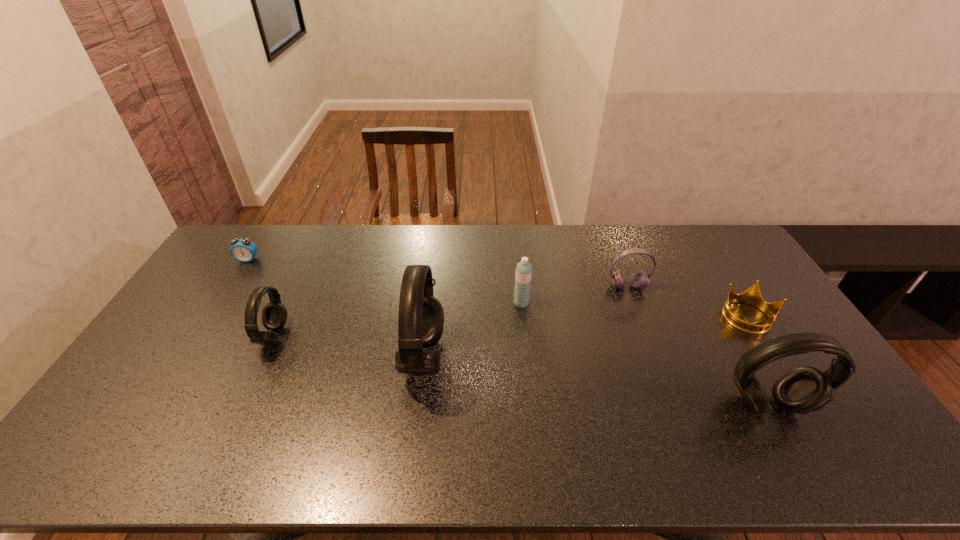
The width and height of the screenshot is (960, 540). What are the coordinates of `vacant space at the near right corner of the desktop` in the screenshot? It's located at (832, 406).

At what (x,y) coordinates should I click in order to perform the action: click on vacant space that is in between the sixth object from right to left and the crown. Please return your answer as a coordinate pair (x, y). Looking at the image, I should click on click(x=511, y=327).

Find the location of a particular element. The image size is (960, 540). free space between the third object from left to right and the second headset from right to left is located at coordinates (525, 322).

Where is `free space that is in between the sixth object from right to left and the water bottle`? The height and width of the screenshot is (540, 960). free space that is in between the sixth object from right to left and the water bottle is located at coordinates (397, 320).

Locate an element on the screen. unoccupied position between the second tallest object and the fifth object from left to right is located at coordinates (698, 346).

Locate an element on the screen. unoccupied position between the second tallest headset and the fourth object from right to left is located at coordinates (644, 354).

I want to click on free area in between the fourth object from right to left and the fifth object from right to left, so click(472, 330).

The image size is (960, 540). Identify the location of free point between the leftmost headset and the fourth object from left to right. (397, 320).

Find the location of `free space between the second headset from left to right and the water bottle`. free space between the second headset from left to right and the water bottle is located at coordinates (472, 330).

Identify the location of object that is the fourth closest one to the rightmost headset. (421, 317).